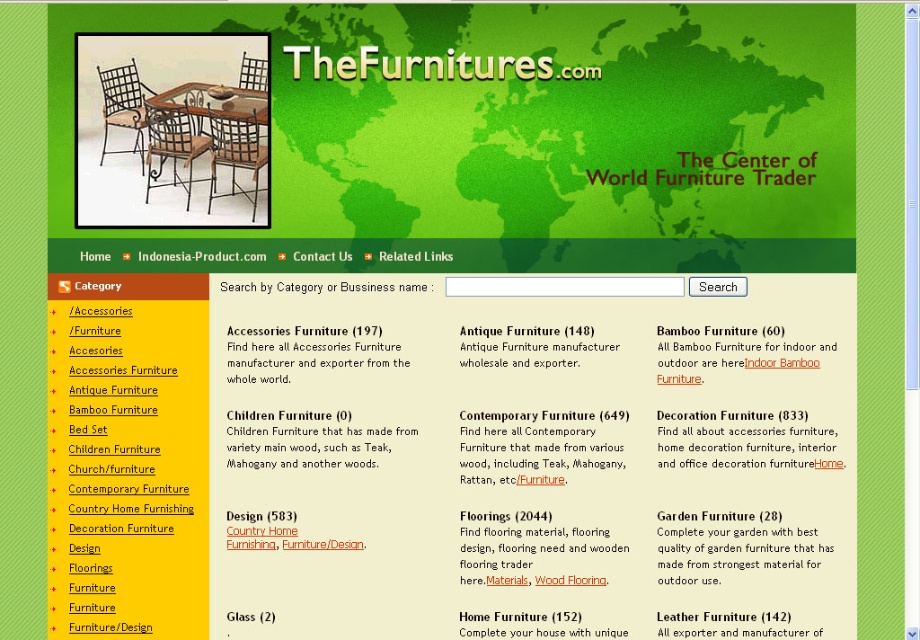
Which of these two, matte black chair at center or metallic wrought iron chair at center, stands shorter?

Standing shorter between the two is metallic wrought iron chair at center.

Does matte black chair at center appear over metallic wrought iron chair at center?

Actually, matte black chair at center is below metallic wrought iron chair at center.

The height and width of the screenshot is (640, 920). What do you see at coordinates (238, 154) in the screenshot? I see `matte black chair at center` at bounding box center [238, 154].

Where is `matte black chair at center`? The image size is (920, 640). matte black chair at center is located at coordinates (238, 154).

Which is in front, point (146, 188) or point (135, 124)?

Point (146, 188) is in front.

Image resolution: width=920 pixels, height=640 pixels. Describe the element at coordinates (171, 148) in the screenshot. I see `matte black metal chair at center` at that location.

Between point (190, 145) and point (135, 138), which one is positioned in front?

Positioned in front is point (135, 138).

Where is `matte black metal chair at center`? The image size is (920, 640). matte black metal chair at center is located at coordinates (171, 148).

Which is in front, point (193, 131) or point (257, 77)?

Positioned in front is point (193, 131).

Which is behind, point (164, 108) or point (248, 125)?

The point (164, 108) is more distant.

Describe the element at coordinates (171, 148) in the screenshot. I see `matte black metal chair at center` at that location.

You are a GUI agent. You are given a task and a screenshot of the screen. Output one action in this format:
    pyautogui.click(x=<x>, y=<y>)
    Task: Click on the matte black metal chair at center
    This screenshot has width=920, height=640.
    Given the screenshot: What is the action you would take?
    pyautogui.click(x=171, y=148)